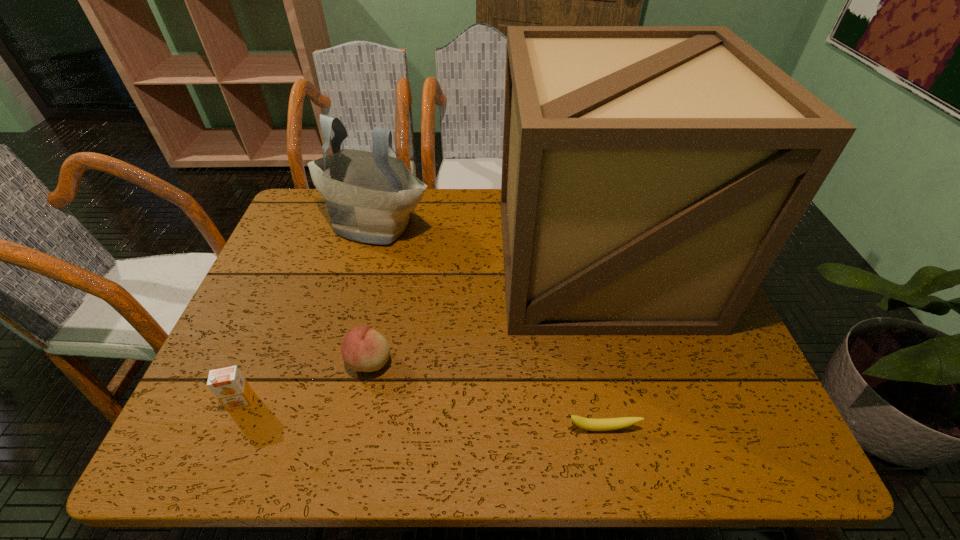
Locate an element on the screen. The height and width of the screenshot is (540, 960). free spot between the third farthest object and the shopping bag is located at coordinates (372, 293).

You are a GUI agent. You are given a task and a screenshot of the screen. Output one action in this format:
    pyautogui.click(x=<x>, y=<y>)
    Task: Click on the vacant region between the nearest object and the second nearest object
    This screenshot has height=540, width=960.
    Given the screenshot: What is the action you would take?
    pyautogui.click(x=421, y=415)

The width and height of the screenshot is (960, 540). What are the coordinates of `free space that is in between the shortest object and the fourth shortest object` in the screenshot? It's located at (489, 326).

Locate an element on the screen. free spot between the shortest object and the fourth shortest object is located at coordinates (489, 326).

This screenshot has width=960, height=540. Identify the location of object identified as the second closest to the box. (607, 424).

Select which object is the second closest to the peach. Please provide its 2D coordinates. Your answer should be formatted as a tuple, i.e. [(x, y)], where the tuple contains the x and y coordinates of a point satisfying the conditions above.

[(651, 175)]